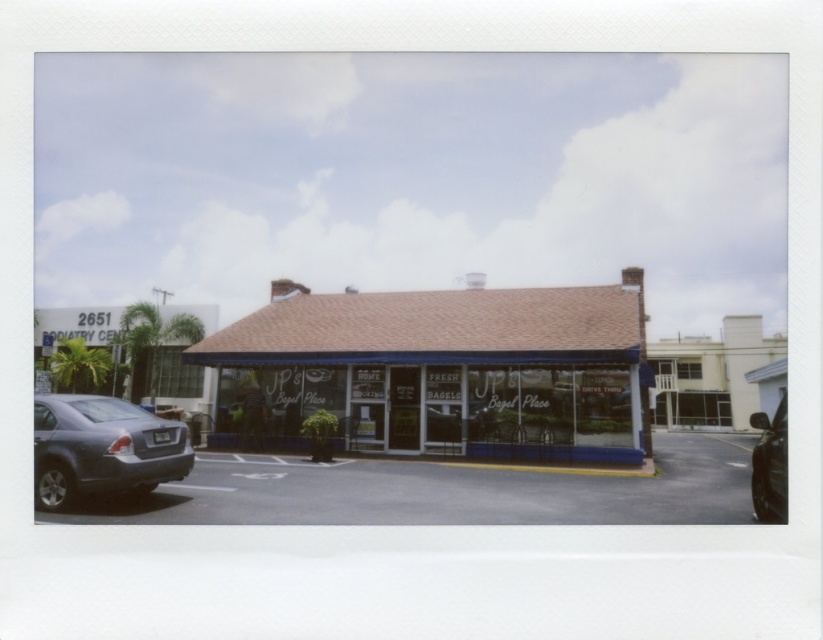
You are standing in front of JP Bagel Place and want to park your car in the parking lot. You see a point marked at coordinates (447,492). Is this point located in the gray asphalt parking lot at lower left?

Yes, the point marked at coordinates (447,492) is located in the gray asphalt parking lot at lower left.

You are a customer arriving at JP Bagel Place. You see the white glass storefront at center and the shiny black car at lower right. Which object is higher up in the image?

The white glass storefront at center is located above the shiny black car at lower right, so it is higher up in the image.